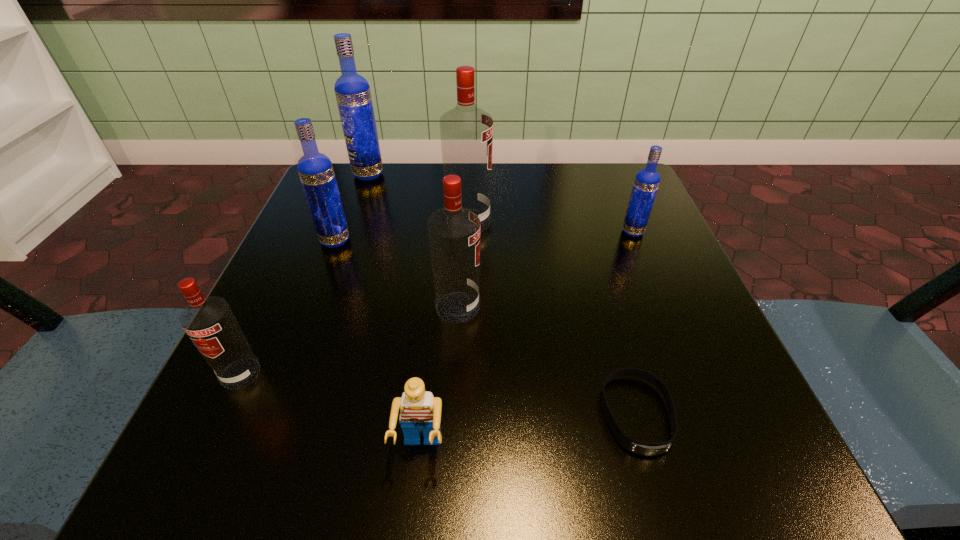
Identify which vodka is the fourth closest to the fifth farthest vodka. Please provide its 2D coordinates. Your answer should be formatted as a tuple, i.e. [(x, y)], where the tuple contains the x and y coordinates of a point satisfying the conditions above.

[(647, 180)]

This screenshot has height=540, width=960. Identify the location of vodka that stands as the fifth closest to the shortest object. (315, 169).

This screenshot has width=960, height=540. What are the coordinates of `blue vodka that is the third nearest to the biggest red vodka` in the screenshot? It's located at (647, 180).

Locate an element on the screen. This screenshot has height=540, width=960. blue vodka that is the second closest to the leftmost red vodka is located at coordinates (352, 91).

What are the coordinates of `red vodka object that ranks as the third closest to the farthest vodka` in the screenshot? It's located at (209, 322).

Select which red vodka is the closest to the leftmost red vodka. Please provide its 2D coordinates. Your answer should be formatted as a tuple, i.e. [(x, y)], where the tuple contains the x and y coordinates of a point satisfying the conditions above.

[(454, 231)]

The height and width of the screenshot is (540, 960). Find the location of `blank space that satisfies the following two spatial constraints: 1. on the front label of the second nearest red vodka; 2. on the face of the Lego`. blank space that satisfies the following two spatial constraints: 1. on the front label of the second nearest red vodka; 2. on the face of the Lego is located at coordinates (451, 449).

Locate an element on the screen. This screenshot has height=540, width=960. vacant space that satisfies the following two spatial constraints: 1. on the front label of the second biggest red vodka; 2. on the front label of the leftmost red vodka is located at coordinates (454, 374).

Where is `blank area in the image that satisfies the following two spatial constraints: 1. on the back side of the rightmost blue vodka; 2. on the front label of the farthest red vodka`? This screenshot has height=540, width=960. blank area in the image that satisfies the following two spatial constraints: 1. on the back side of the rightmost blue vodka; 2. on the front label of the farthest red vodka is located at coordinates (629, 222).